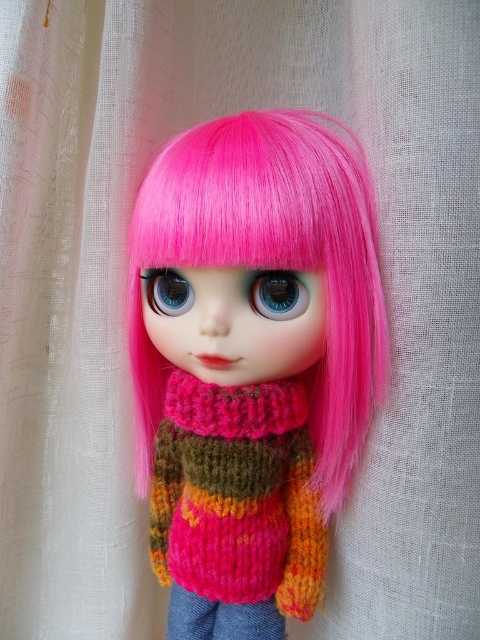
You are a photographer setting up a shoot for a doll. The doll is wearing a knitted wool sweater at center. You need to place a small accessory exactly at the coordinates point (237, 496). Where should you place the accessory on the doll?

The point (237, 496) corresponds to the knitted wool sweater at center, so you should place the accessory on the knitted wool sweater at center.

You are an artist observing the doll and want to paint its eyes. The blue glossy eye at center and the bluematteeye at center are both blue. Which eye appears more reflective?

The blue glossy eye at center appears more reflective because it is in front of the bluematteeye at center.